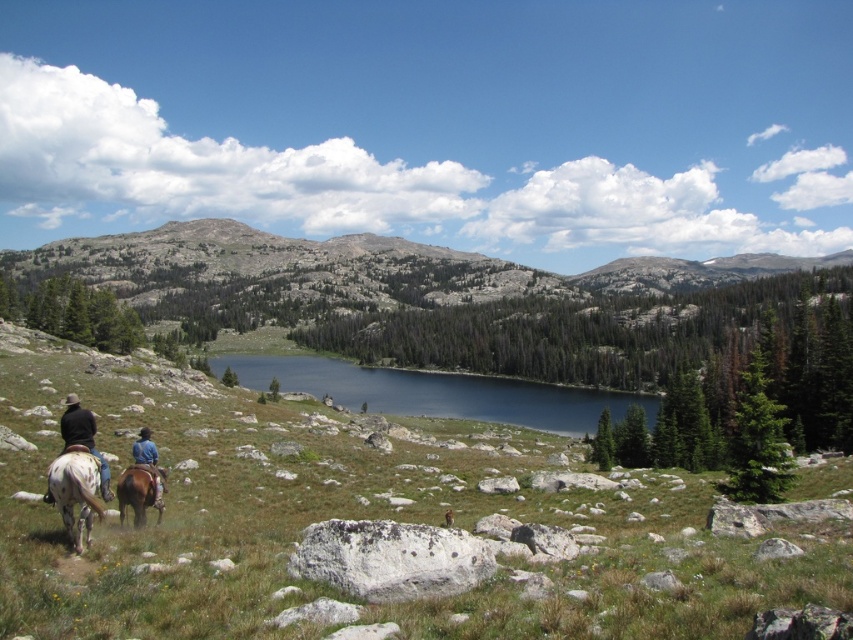
Does brown glossy horse at lower left appear on the left side of blue denim jeans at lower left?

Incorrect, brown glossy horse at lower left is not on the left side of blue denim jeans at lower left.

Is point (136, 520) more distant than point (155, 502)?

No, it is not.

The width and height of the screenshot is (853, 640). Find the location of `brown glossy horse at lower left`. brown glossy horse at lower left is located at coordinates (140, 492).

Between point (817, 593) and point (68, 522), which one is positioned behind?

The point (68, 522) is behind.

Describe the element at coordinates (361, 522) in the screenshot. I see `green grassy field at lower center` at that location.

At what (x,y) coordinates should I click in order to perform the action: click on green grassy field at lower center. Please return your answer as a coordinate pair (x, y). Looking at the image, I should click on (361, 522).

Which is more to the left, green grassy field at lower center or smooth dark blue water at center?

Positioned to the left is green grassy field at lower center.

Can you confirm if green grassy field at lower center is bigger than smooth dark blue water at center?

Yes.

Identify the location of green grassy field at lower center. (361, 522).